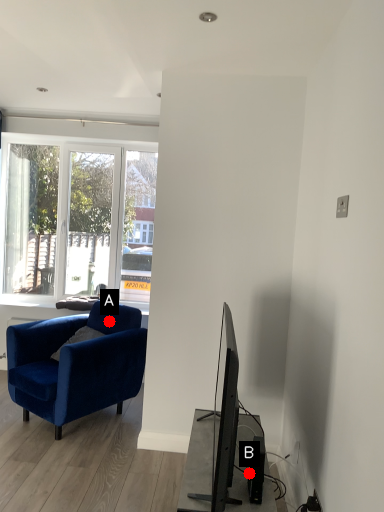
Question: Two points are circled on the image, labeled by A and B beside each circle. Which point is closer to the camera?

Choices:
 (A) A is closer
 (B) B is closer

Answer: (B)